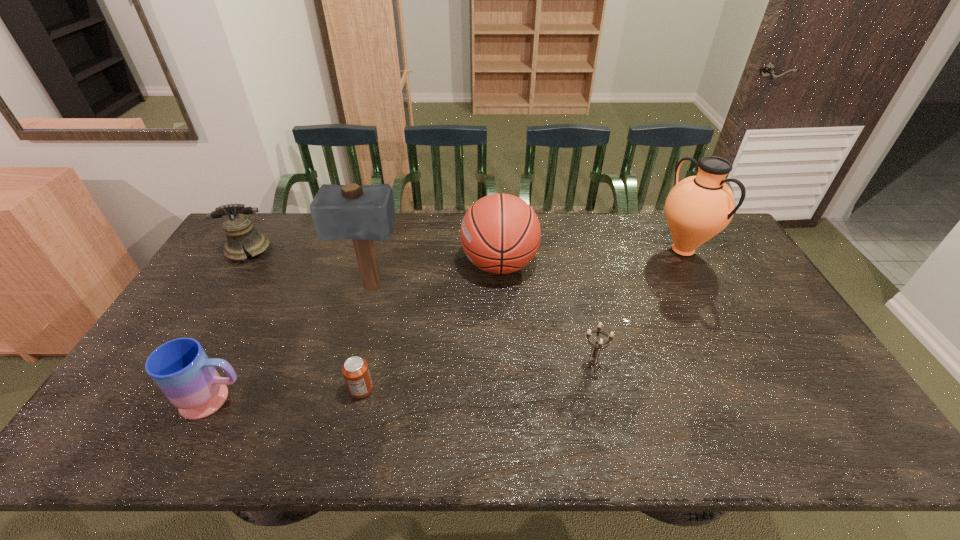
Where is `free space located on the left of the pitcher`? free space located on the left of the pitcher is located at coordinates coord(613,250).

The width and height of the screenshot is (960, 540). I want to click on free space located on the logo side of the fifth object from left to right, so click(x=446, y=265).

I want to click on vacant space located 0.330m on the logo side of the fifth object from left to right, so click(x=362, y=265).

You are a GUI agent. You are given a task and a screenshot of the screen. Output one action in this format:
    pyautogui.click(x=<x>, y=<y>)
    Task: Click on the free space located on the logo side of the fifth object from left to right
    The image size is (960, 540).
    Given the screenshot: What is the action you would take?
    pyautogui.click(x=422, y=265)

Find the location of a particular element. vacant space located on the front of the bell is located at coordinates (212, 308).

Locate an element on the screen. This screenshot has width=960, height=540. blank space located 0.060m on the side of the mug with the handle is located at coordinates (274, 400).

This screenshot has width=960, height=540. I want to click on vacant space situated 0.120m on the left of the fifth farthest object, so click(x=534, y=366).

Locate an element on the screen. vacant space located on the left of the shortest object is located at coordinates (322, 389).

The image size is (960, 540). Identify the location of pitcher that is at the far edge. (697, 208).

The height and width of the screenshot is (540, 960). In order to click on basketball located at the far edge in this screenshot , I will do `click(500, 233)`.